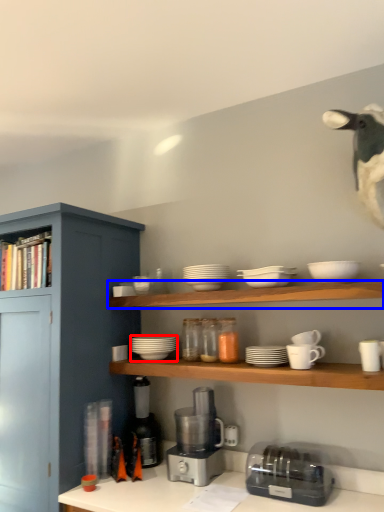
Question: Which point is closer to the camera, tableware (highlighted by a red box) or shelf (highlighted by a blue box)?

Choices:
 (A) tableware
 (B) shelf

Answer: (B)